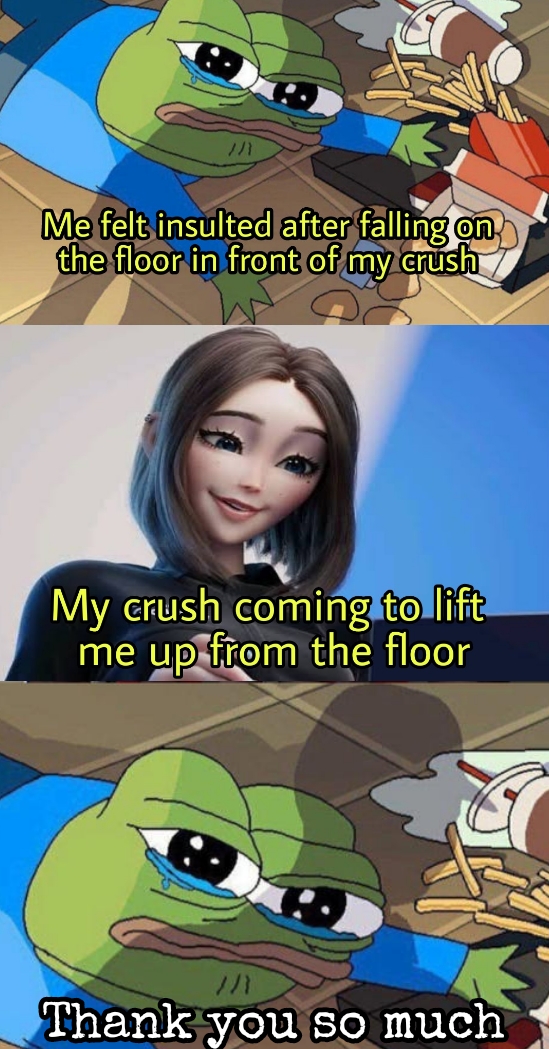
What are the coordinates of `floor` in the screenshot? It's located at (272, 193), (396, 869).